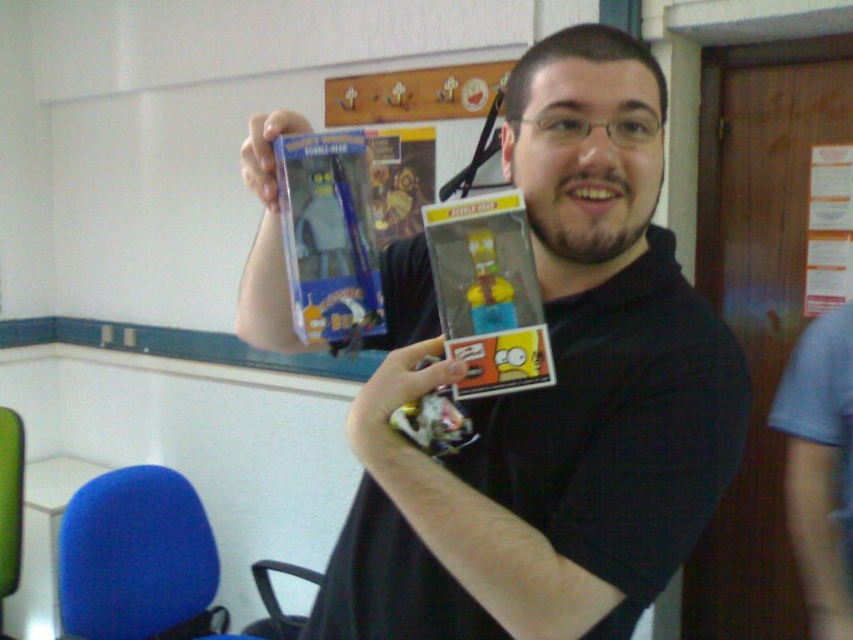
Does translucent plastic figure at center appear over matte plastic toy at center?

Yes, translucent plastic figure at center is above matte plastic toy at center.

Is translucent plastic figure at center wider than matte plastic toy at center?

Incorrect, translucent plastic figure at center's width does not surpass matte plastic toy at center's.

Identify the location of translucent plastic figure at center. This screenshot has height=640, width=853. (488, 292).

What do you see at coordinates (488, 292) in the screenshot? I see `translucent plastic figure at center` at bounding box center [488, 292].

Can you confirm if translucent plastic figure at center is bigger than glossy plastic toy at upper center?

No.

Where is `translucent plastic figure at center`? The width and height of the screenshot is (853, 640). translucent plastic figure at center is located at coordinates (488, 292).

Is matte plastic toy at center smaller than matte plastic toy at upper center?

Correct, matte plastic toy at center occupies less space than matte plastic toy at upper center.

Between point (387, 422) and point (294, 113), which one is positioned in front?

Point (387, 422) is more forward.

Where is `matte plastic toy at center`? The height and width of the screenshot is (640, 853). matte plastic toy at center is located at coordinates (431, 420).